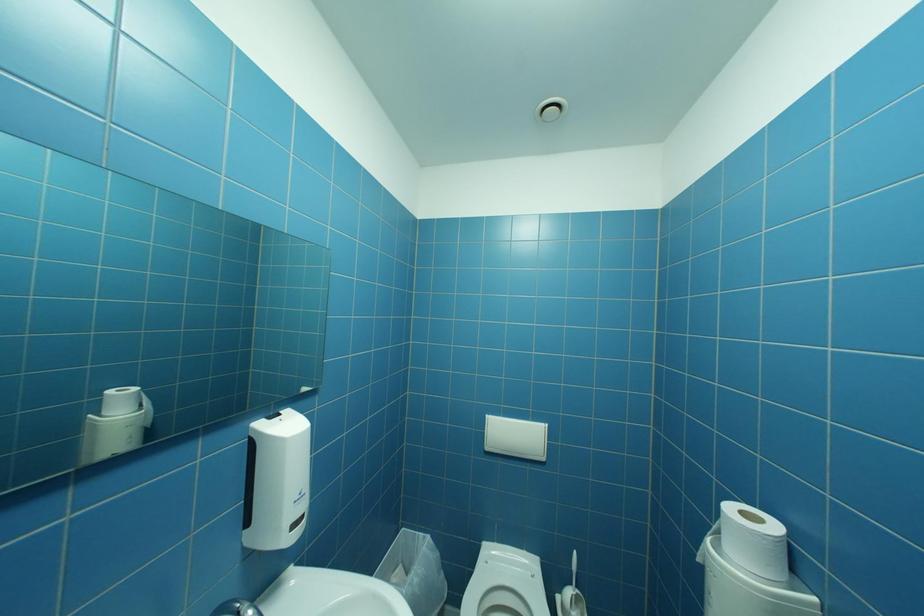
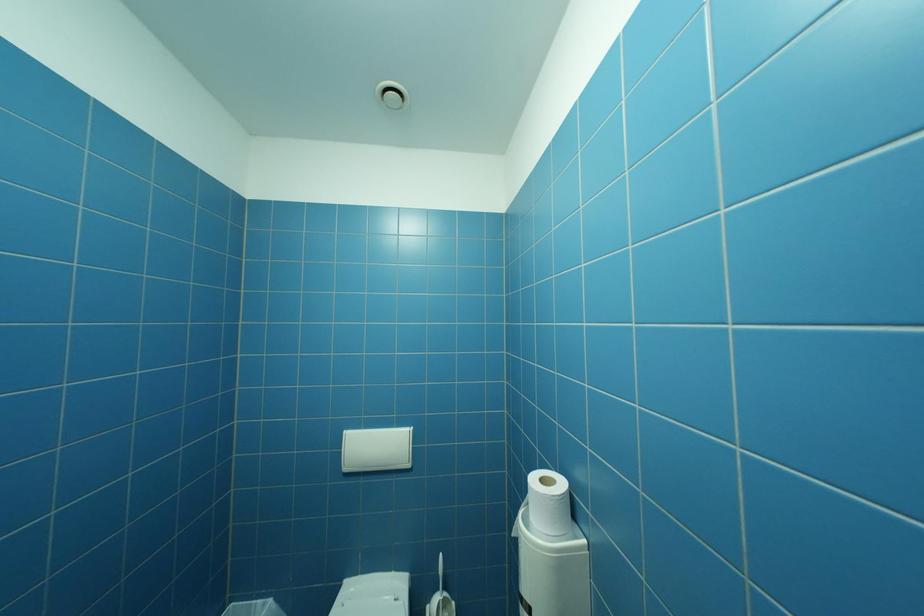
Question: What movement of the cameraman would produce the second image?

Choices:
 (A) Left
 (B) Right
 (C) Forward
 (D) Backward

Answer: (B)